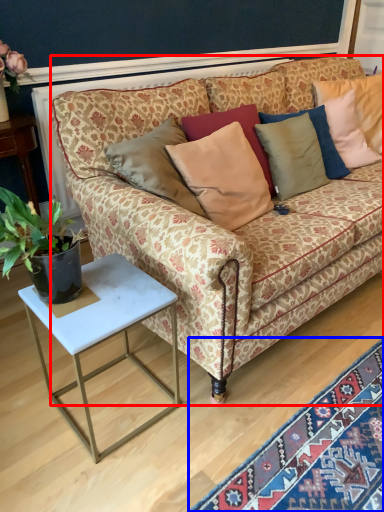
Question: Among these objects, which one is farthest to the camera, studio couch (highlighted by a red box) or mat (highlighted by a blue box)?

Choices:
 (A) studio couch
 (B) mat

Answer: (A)